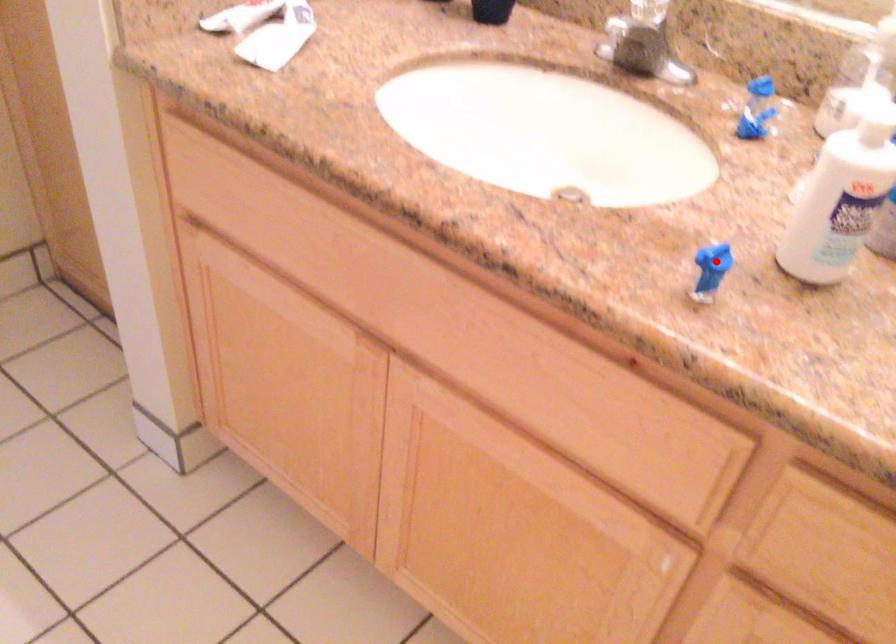
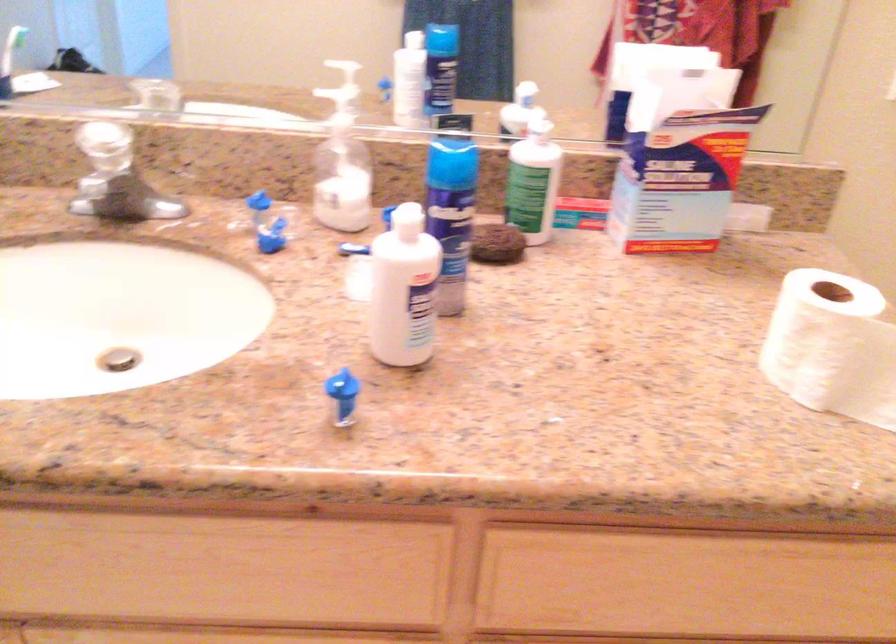
The point at the highlighted location is marked in the first image. Where is the corresponding point in the second image?

(341, 386)